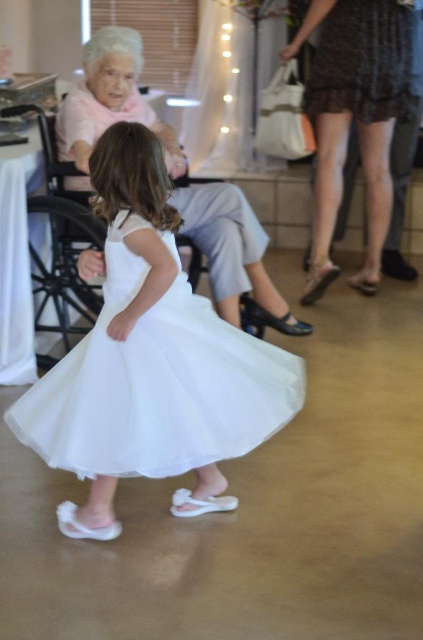
Does white tulle dress at center have a larger size compared to matte pink dress at upper left?

No, white tulle dress at center is not bigger than matte pink dress at upper left.

This screenshot has width=423, height=640. What do you see at coordinates (156, 384) in the screenshot?
I see `white tulle dress at center` at bounding box center [156, 384].

Where is `white tulle dress at center`? The image size is (423, 640). white tulle dress at center is located at coordinates (156, 384).

Is white tulle dress at center positioned at the back of dark brown textured dress at upper right?

No, it is not.

Who is lower down, white tulle dress at center or dark brown textured dress at upper right?

white tulle dress at center

What do you see at coordinates (156, 384) in the screenshot?
I see `white tulle dress at center` at bounding box center [156, 384].

In order to click on white tulle dress at center in this screenshot , I will do `click(156, 384)`.

Is dark brown textured dress at upper right positioned behind matte pink dress at upper left?

Yes.

Measure the distance between point (384, 148) and camera.

3.57 meters

Image resolution: width=423 pixels, height=640 pixels. I want to click on dark brown textured dress at upper right, so click(x=354, y=118).